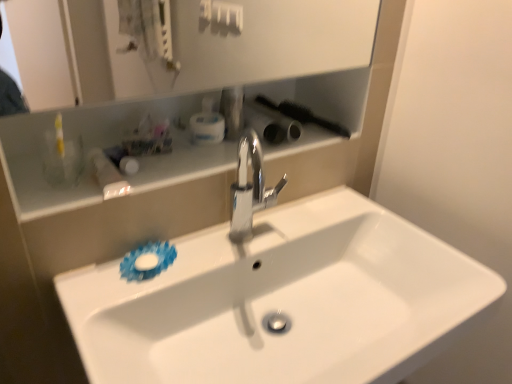
This screenshot has width=512, height=384. In order to click on free space that is to the left of polished chrome faucet at center in this screenshot , I will do `click(201, 253)`.